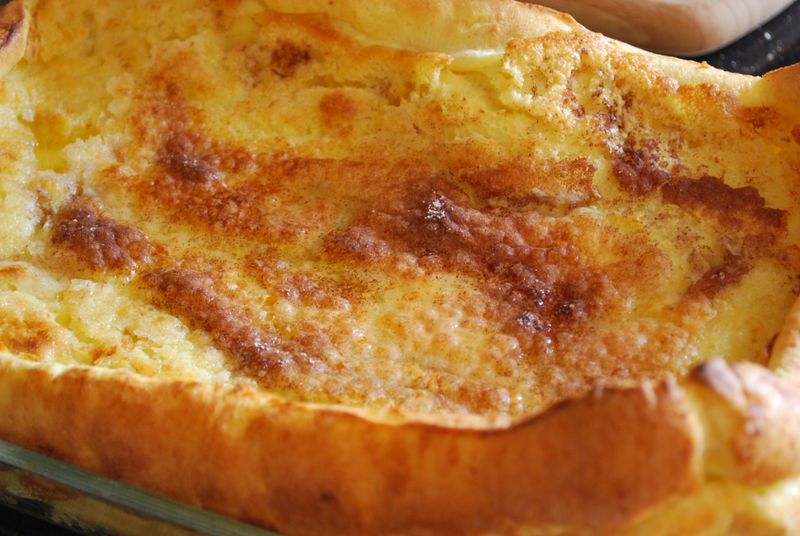
Image resolution: width=800 pixels, height=536 pixels. In order to click on table in this screenshot , I will do `click(768, 44)`.